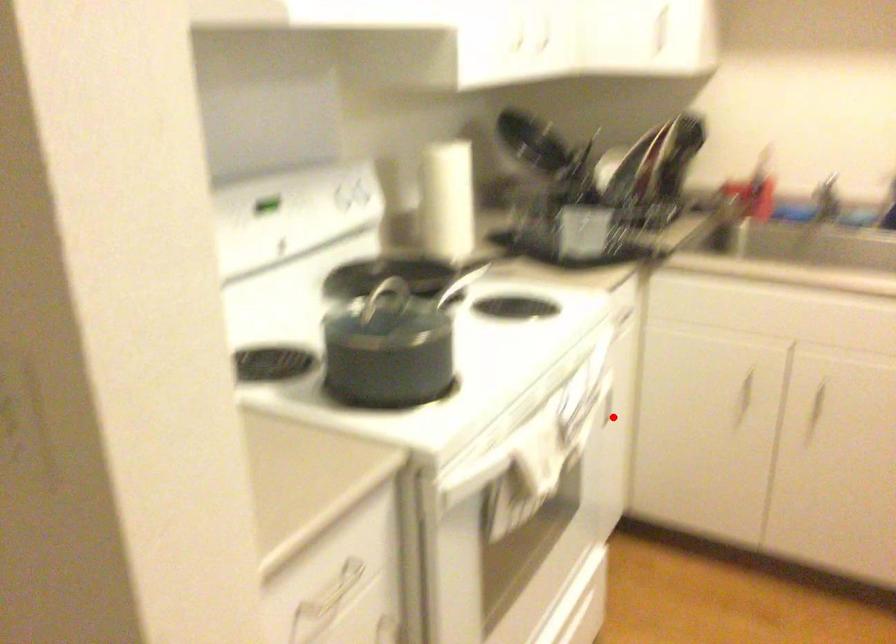
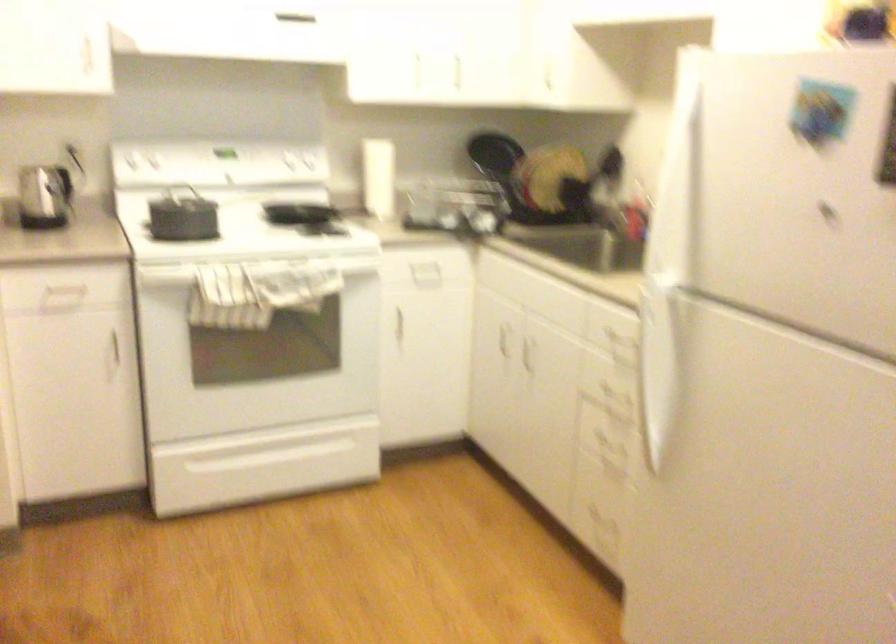
Question: I am providing you with two images of the same scene from different viewpoints. A red point is shown in image1. For the corresponding object point in image2, is it positioned nearer or farther from the camera?

Choices:
 (A) Nearer
 (B) Farther

Answer: (B)